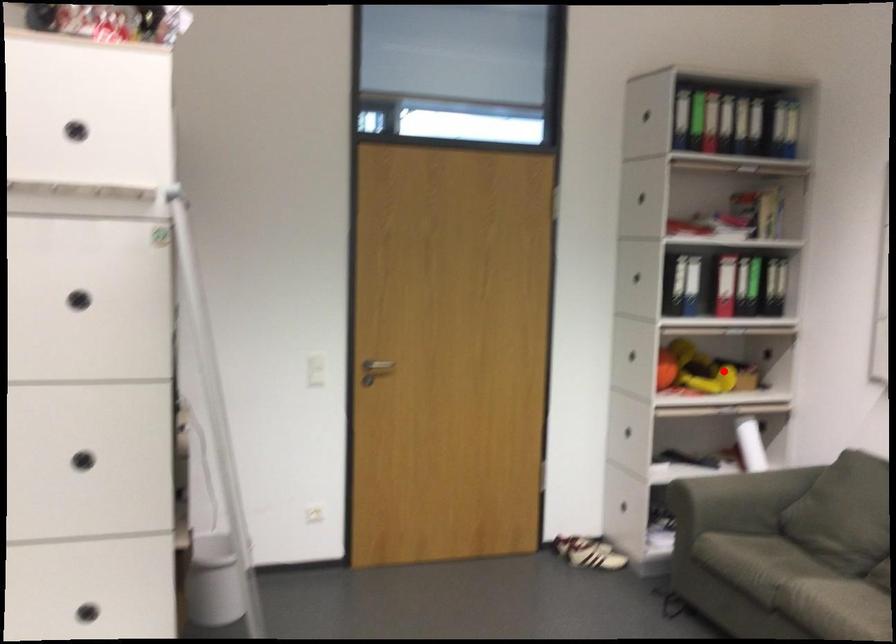
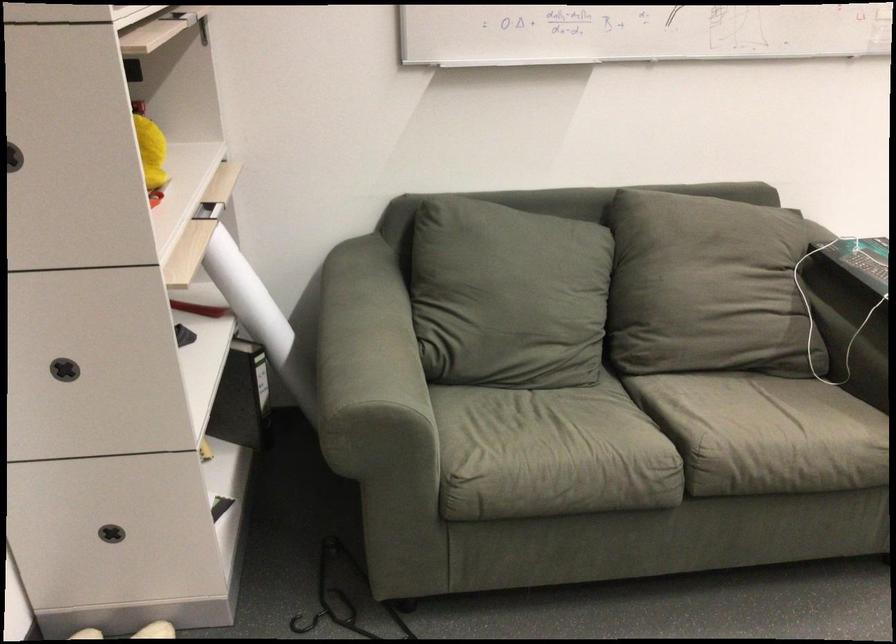
Locate, in the second image, the point that corresponds to the highlighted location in the first image.

(151, 152)